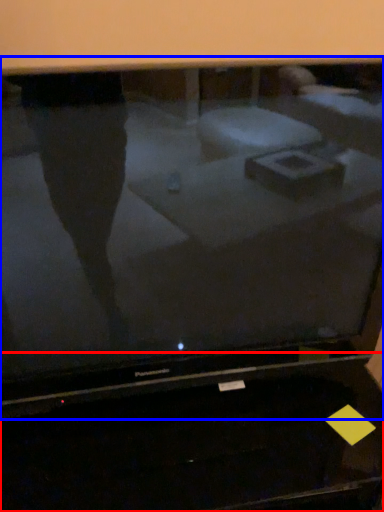
Question: Which object appears closest to the camera in this image, desktop (highlighted by a red box) or television (highlighted by a blue box)?

Choices:
 (A) desktop
 (B) television

Answer: (B)